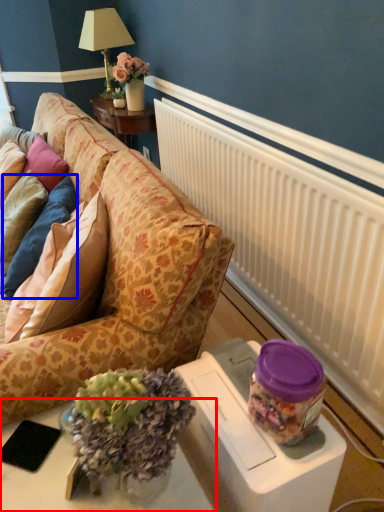
Question: Which point is closer to the camera, table (highlighted by a red box) or pillow (highlighted by a blue box)?

Choices:
 (A) table
 (B) pillow

Answer: (A)